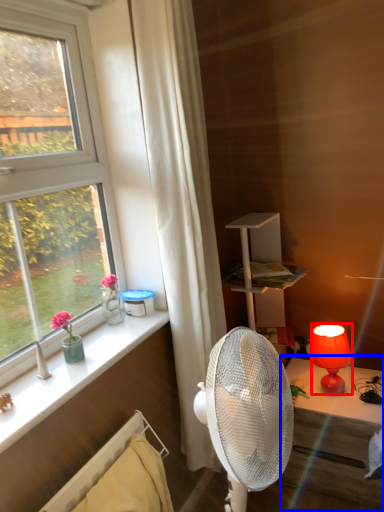
Question: Among these objects, which one is nearest to the camera, lamp (highlighted by a red box) or table (highlighted by a blue box)?

Choices:
 (A) lamp
 (B) table

Answer: (B)